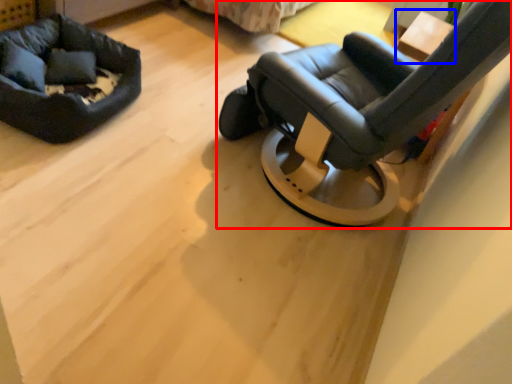
Question: Among these objects, which one is farthest to the camera, chair (highlighted by a red box) or table (highlighted by a blue box)?

Choices:
 (A) chair
 (B) table

Answer: (B)